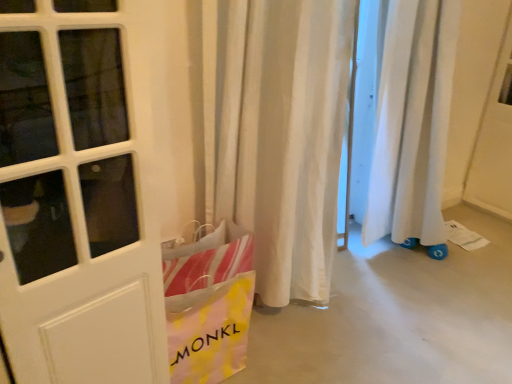
In order to click on vacant point to the right of yellow and pink plastic bag at lower left in this screenshot , I will do `click(275, 341)`.